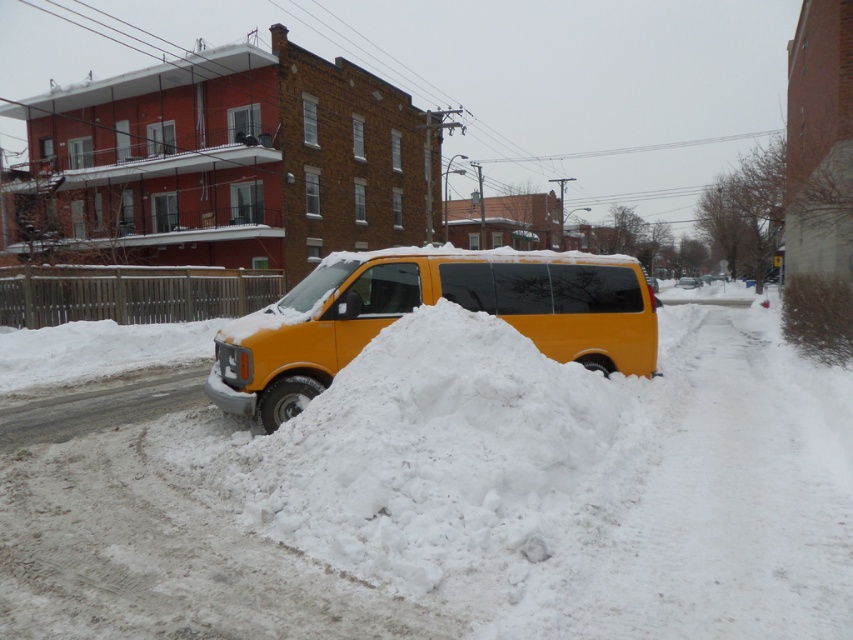
Question: Which of the following is the closest to the observer?

Choices:
 (A) (518, 556)
 (B) (309, 340)

Answer: (A)

Question: From the image, what is the correct spatial relationship of snowy white mound at center in relation to yellow matte van at center?

Choices:
 (A) right
 (B) left

Answer: (A)

Question: Among these points, which one is farthest from the camera?

Choices:
 (A) (621, 276)
 (B) (538, 353)

Answer: (A)

Question: Is snowy white mound at center to the right of yellow matte van at center from the viewer's perspective?

Choices:
 (A) yes
 (B) no

Answer: (A)

Question: Is snowy white mound at center thinner than yellow matte van at center?

Choices:
 (A) yes
 (B) no

Answer: (B)

Question: Which point is closer to the camera?

Choices:
 (A) yellow matte van at center
 (B) snowy white mound at center

Answer: (B)